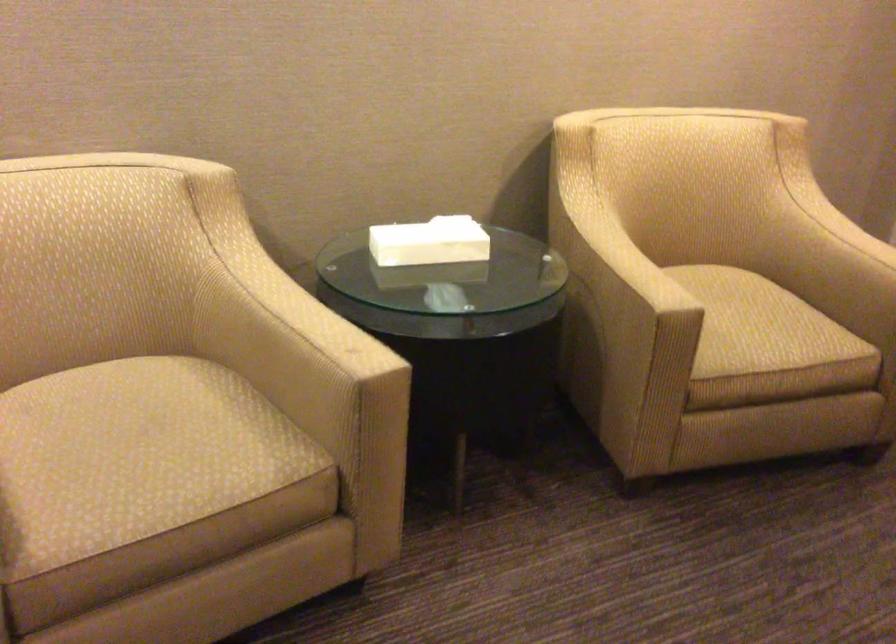
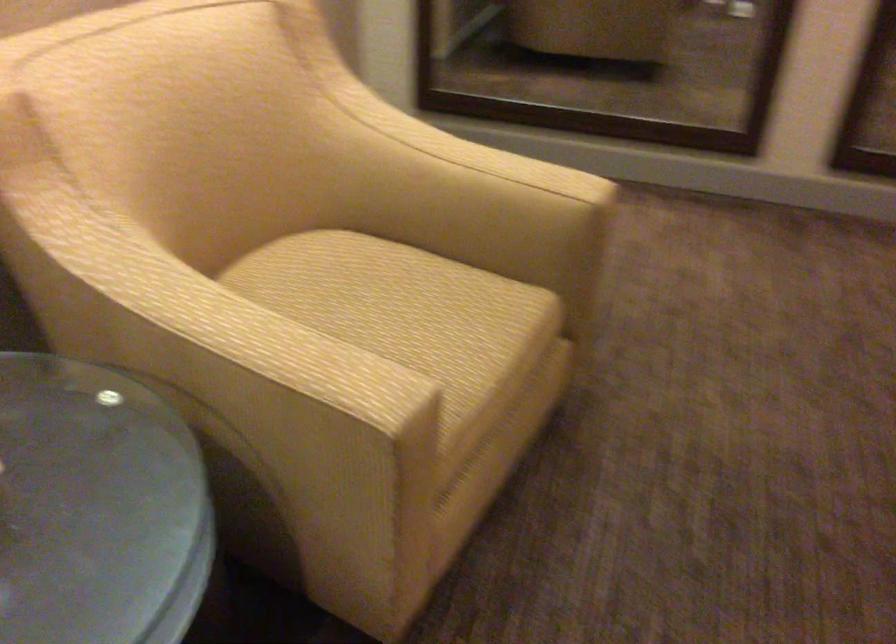
In the second image, find the point that corresponds to (x=617, y=241) in the first image.

(214, 313)